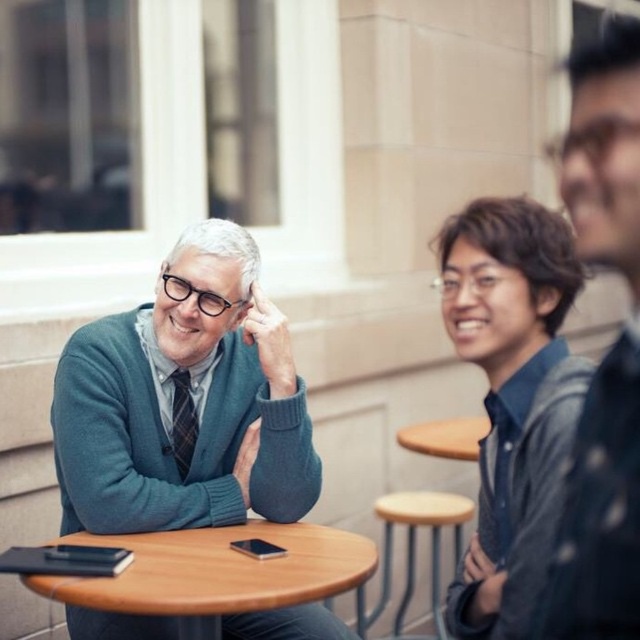
You are a fashion designer observing the two outfits in the image. The teal sweater at center and the dark blue textured shirt at right are both part of a new collection. Which of these two items has a greater horizontal span when laid flat?

The teal sweater at center has a greater horizontal span when laid flat because its width is larger than that of the dark blue textured shirt at right.

You are sitting at the wooden round table at center and want to reach the wooden stool at lower center. Which direction should you move to get closer to it?

Since the wooden round table at center is closer to the viewer than the wooden stool at lower center, you would need to move backward to get closer to the wooden stool at lower center.

You are a customer at the outdoor cafe and want to order a drink for the person wearing the teal sweater at center and the dark blue textured shirt at right. The server asks which person is closer to you. Based on their positions, can you determine who is closer?

The teal sweater at center is positioned under dark blue textured shirt at right, meaning the dark blue textured shirt at right is higher up and thus farther away from you. Therefore, the teal sweater at center is closer to you.